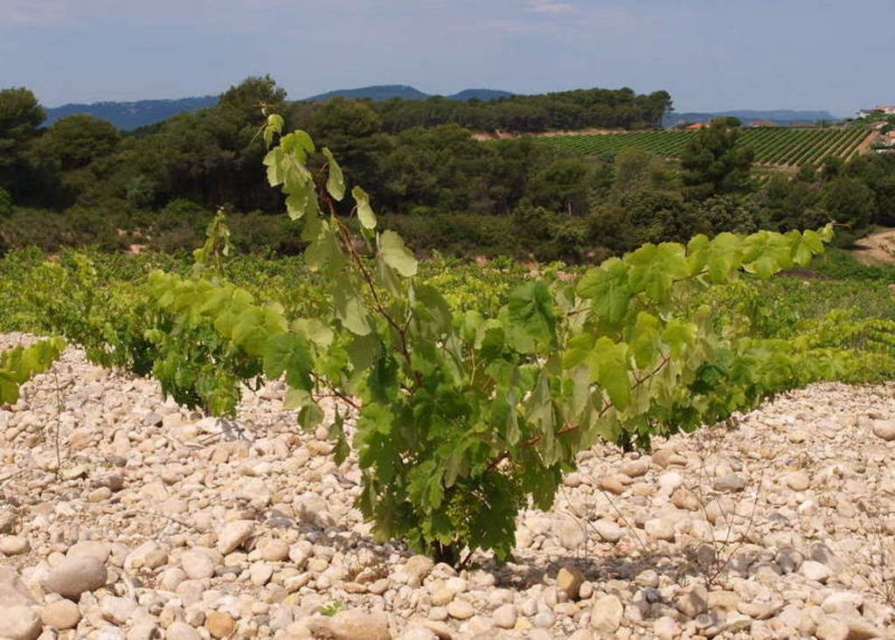
Is light brown gravel at center taller than green leafy plant at center?

No.

What do you see at coordinates (425, 557) in the screenshot?
I see `light brown gravel at center` at bounding box center [425, 557].

Between point (50, 627) and point (463, 518), which one is positioned behind?

The point (463, 518) is behind.

The height and width of the screenshot is (640, 895). Find the location of `light brown gravel at center`. light brown gravel at center is located at coordinates (425, 557).